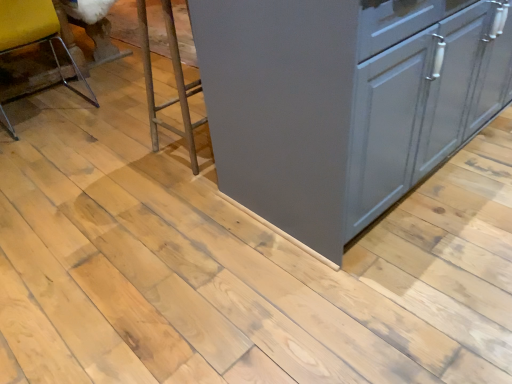
Where is `free area below clear plastic chair at left (from a real-world perspective)`? The image size is (512, 384). free area below clear plastic chair at left (from a real-world perspective) is located at coordinates (47, 110).